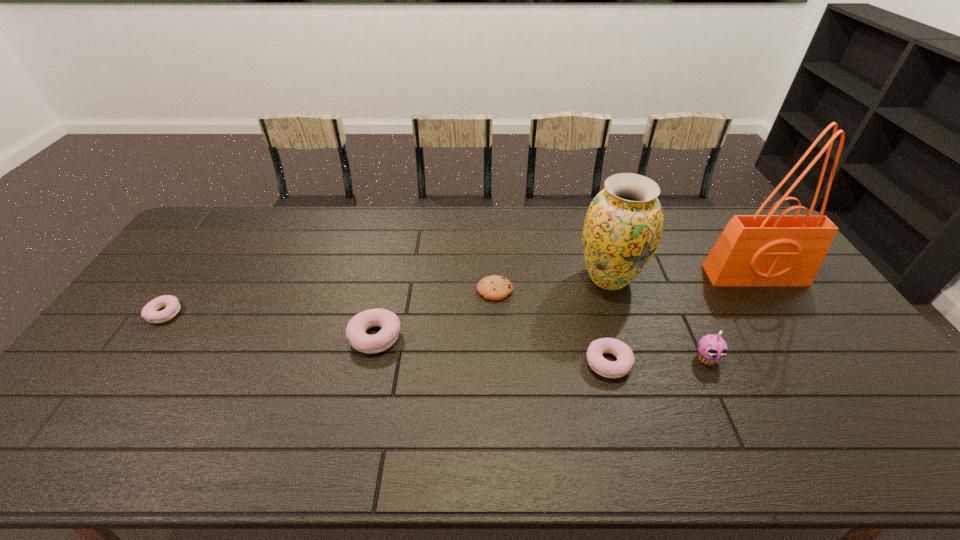
Find the location of a particular element. doughnut that is the second closest one to the rightmost object is located at coordinates (356, 328).

This screenshot has width=960, height=540. I want to click on the third closest doughnut relative to the tallest object, so click(151, 313).